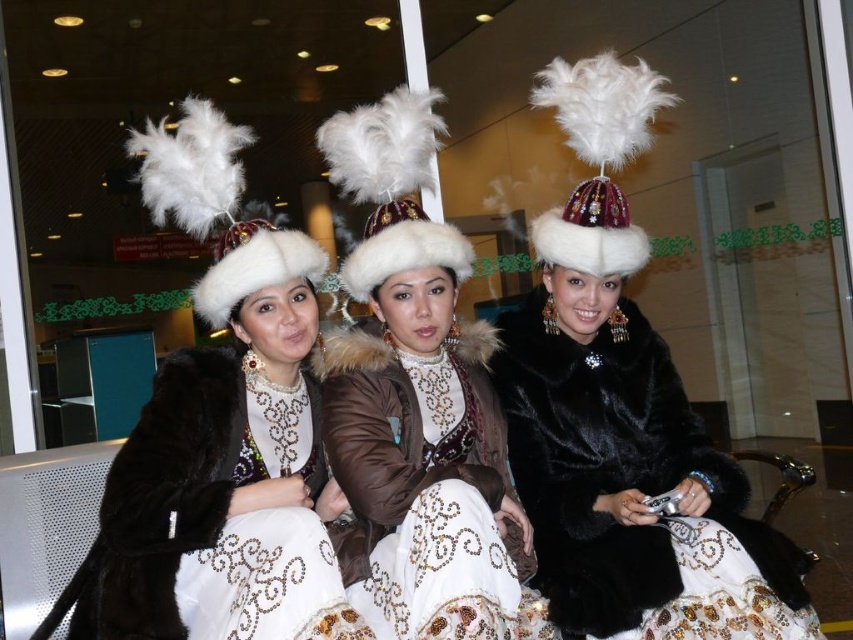
Question: Is matte black fur coat at left thinner than brown leather jacket at center?

Choices:
 (A) no
 (B) yes

Answer: (A)

Question: Which point is farther to the camera?

Choices:
 (A) black fur coat at center
 (B) brown leather jacket at center

Answer: (A)

Question: Among these objects, which one is farthest from the camera?

Choices:
 (A) brown leather jacket at center
 (B) black fur coat at center
 (C) matte black fur coat at left

Answer: (B)

Question: Which point is farther to the camera?

Choices:
 (A) black fur coat at center
 (B) brown leather jacket at center
 (C) matte black fur coat at left

Answer: (A)

Question: Does matte black fur coat at left have a larger size compared to black fur coat at center?

Choices:
 (A) yes
 (B) no

Answer: (A)

Question: Can you confirm if brown leather jacket at center is positioned above black fur coat at center?

Choices:
 (A) no
 (B) yes

Answer: (A)